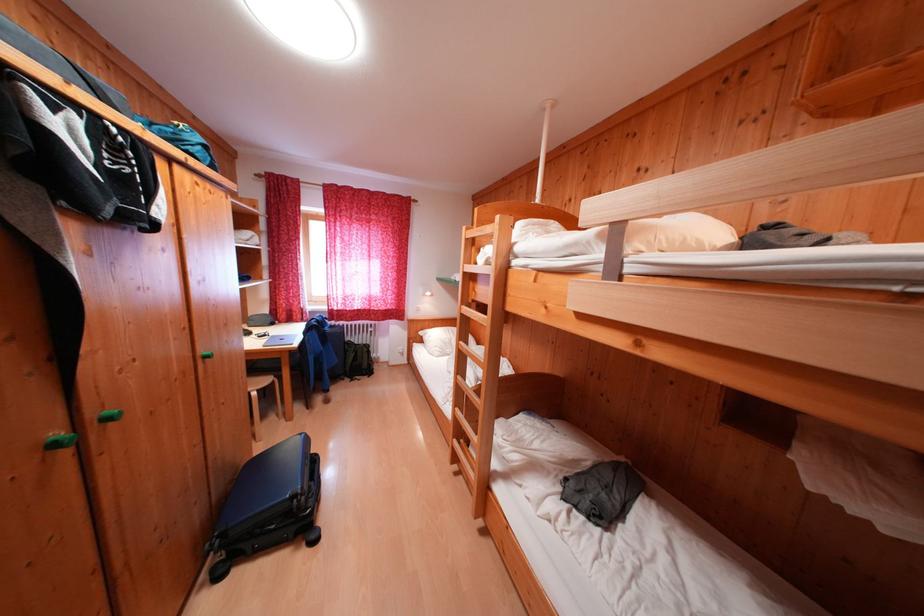
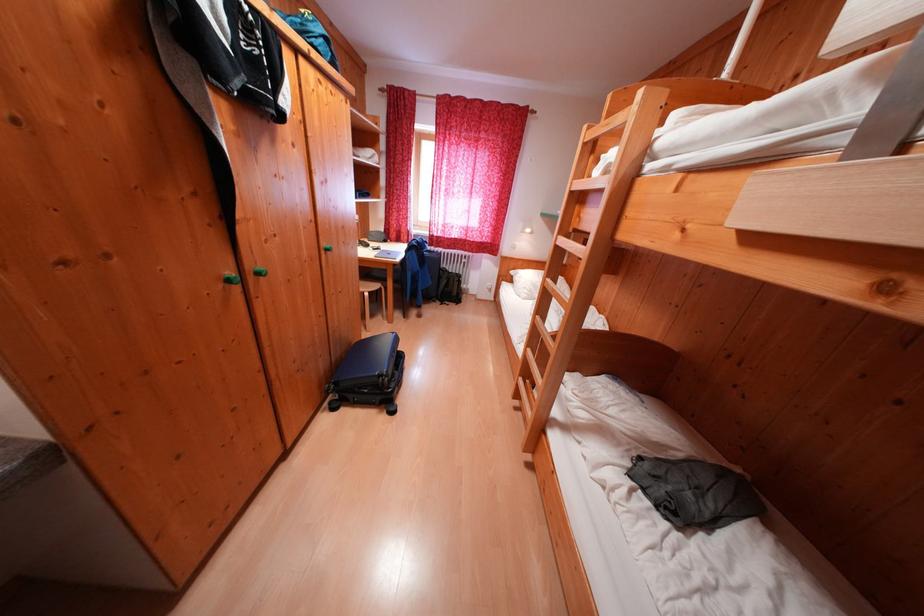
Locate, in the second image, the point that corresponds to point (67, 438) in the first image.

(238, 278)